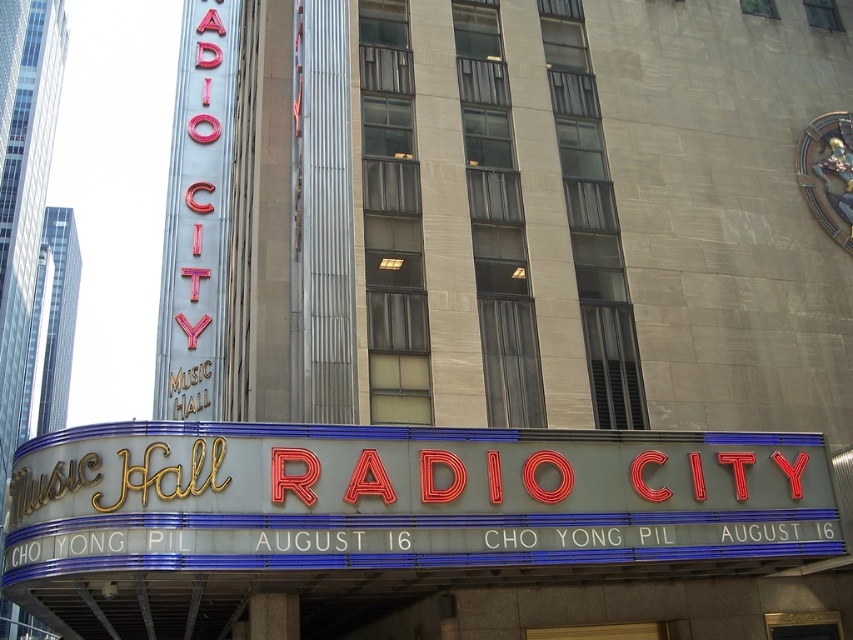
Question: In this image, where is neon red sign at center located relative to neon red sign at left?

Choices:
 (A) left
 (B) right

Answer: (B)

Question: Is neon red sign at center further to the viewer compared to neon red sign at left?

Choices:
 (A) no
 (B) yes

Answer: (A)

Question: Which object appears farthest from the camera in this image?

Choices:
 (A) neon red sign at left
 (B) neon red sign at center

Answer: (A)

Question: Can you confirm if neon red sign at center is bigger than neon red sign at left?

Choices:
 (A) no
 (B) yes

Answer: (A)